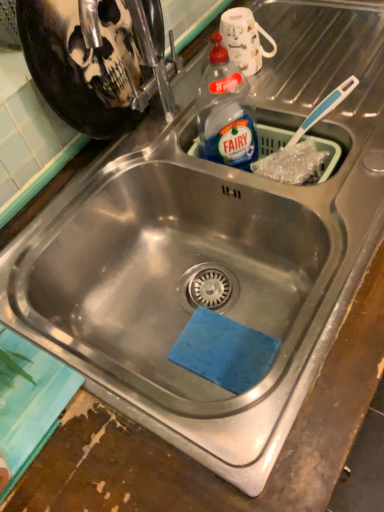
Question: From the image's perspective, is transparent plastic bottle at upper right under white glossy mug at upper center?

Choices:
 (A) yes
 (B) no

Answer: (A)

Question: Considering the relative positions of transparent plastic bottle at upper right and white glossy mug at upper center in the image provided, is transparent plastic bottle at upper right to the left of white glossy mug at upper center from the viewer's perspective?

Choices:
 (A) no
 (B) yes

Answer: (B)

Question: Is transparent plastic bottle at upper right oriented away from white glossy mug at upper center?

Choices:
 (A) yes
 (B) no

Answer: (B)

Question: Is transparent plastic bottle at upper right thinner than white glossy mug at upper center?

Choices:
 (A) no
 (B) yes

Answer: (B)

Question: From a real-world perspective, is transparent plastic bottle at upper right physically below white glossy mug at upper center?

Choices:
 (A) no
 (B) yes

Answer: (B)

Question: Does transparent plastic bottle at upper right have a larger size compared to white glossy mug at upper center?

Choices:
 (A) no
 (B) yes

Answer: (B)

Question: Is white glossy mug at upper center at the left side of transparent plastic bottle at upper right?

Choices:
 (A) no
 (B) yes

Answer: (A)

Question: Considering the relative sizes of white glossy mug at upper center and transparent plastic bottle at upper right in the image provided, is white glossy mug at upper center taller than transparent plastic bottle at upper right?

Choices:
 (A) no
 (B) yes

Answer: (A)

Question: From the image's perspective, is white glossy mug at upper center located beneath transparent plastic bottle at upper right?

Choices:
 (A) no
 (B) yes

Answer: (A)

Question: Is transparent plastic bottle at upper right completely or partially inside white glossy mug at upper center?

Choices:
 (A) yes
 (B) no

Answer: (B)

Question: Is white glossy mug at upper center outside transparent plastic bottle at upper right?

Choices:
 (A) no
 (B) yes

Answer: (B)

Question: From the image's perspective, does white glossy mug at upper center appear higher than transparent plastic bottle at upper right?

Choices:
 (A) yes
 (B) no

Answer: (A)

Question: Is transparent plastic bottle at upper right inside the boundaries of white glossy mug at upper center, or outside?

Choices:
 (A) inside
 (B) outside

Answer: (B)